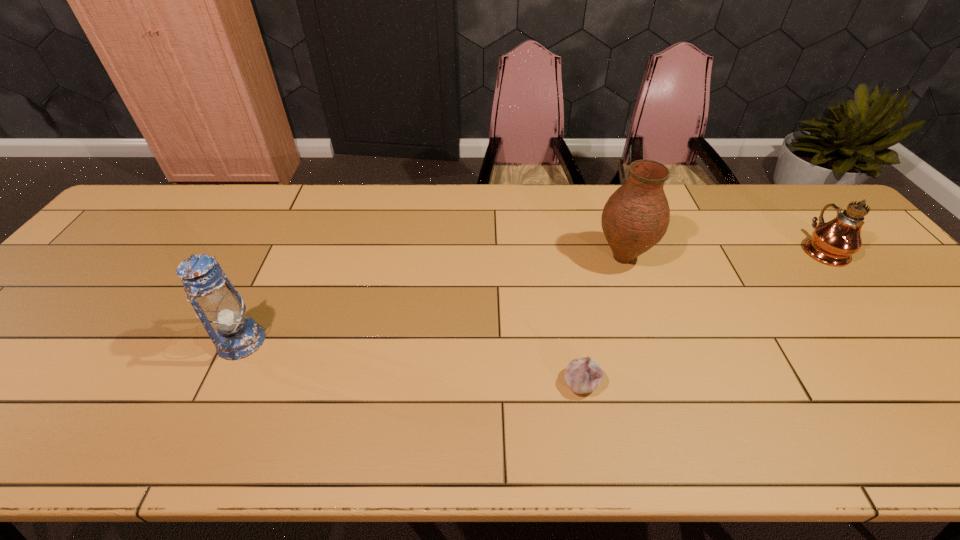
Find the location of a particular element. This screenshot has height=540, width=960. vacant space that satisfies the following two spatial constraints: 1. on the front side of the oil lamp; 2. on the front-facing side of the third farthest object is located at coordinates (900, 341).

Where is `free point that satisfies the following two spatial constraints: 1. on the front-facing side of the leftmost object; 2. on the left side of the garlic`? free point that satisfies the following two spatial constraints: 1. on the front-facing side of the leftmost object; 2. on the left side of the garlic is located at coordinates (222, 382).

The height and width of the screenshot is (540, 960). I want to click on vacant space that satisfies the following two spatial constraints: 1. on the back side of the oil lamp; 2. on the left side of the vase, so click(620, 248).